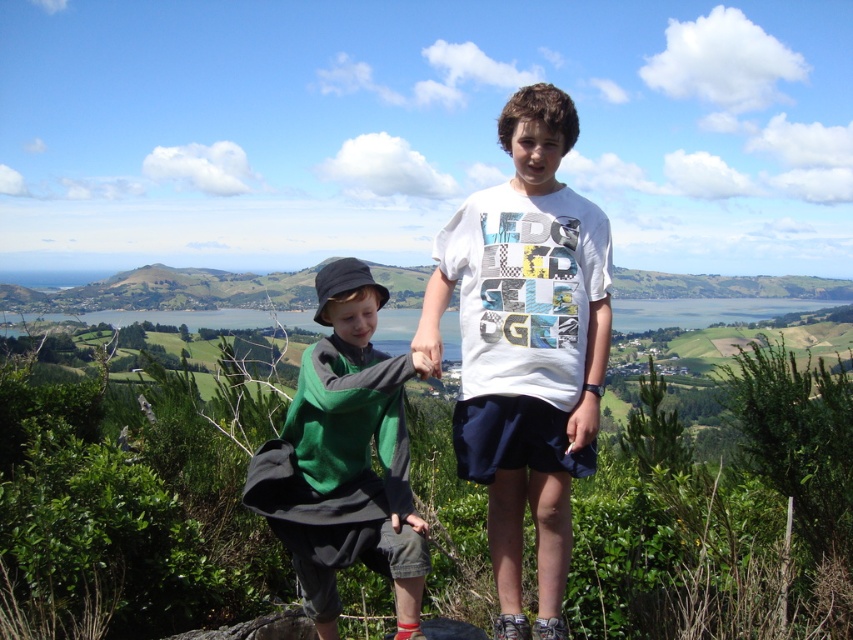
Question: Which point is closer to the camera taking this photo?

Choices:
 (A) (463, 348)
 (B) (270, 509)

Answer: (B)

Question: Does white printed t-shirt at center have a larger size compared to green fabric shirt at center?

Choices:
 (A) no
 (B) yes

Answer: (B)

Question: Where is white printed t-shirt at center located in relation to green fabric shirt at center in the image?

Choices:
 (A) left
 (B) right

Answer: (B)

Question: Where is white printed t-shirt at center located in relation to green fabric shirt at center in the image?

Choices:
 (A) left
 (B) right

Answer: (B)